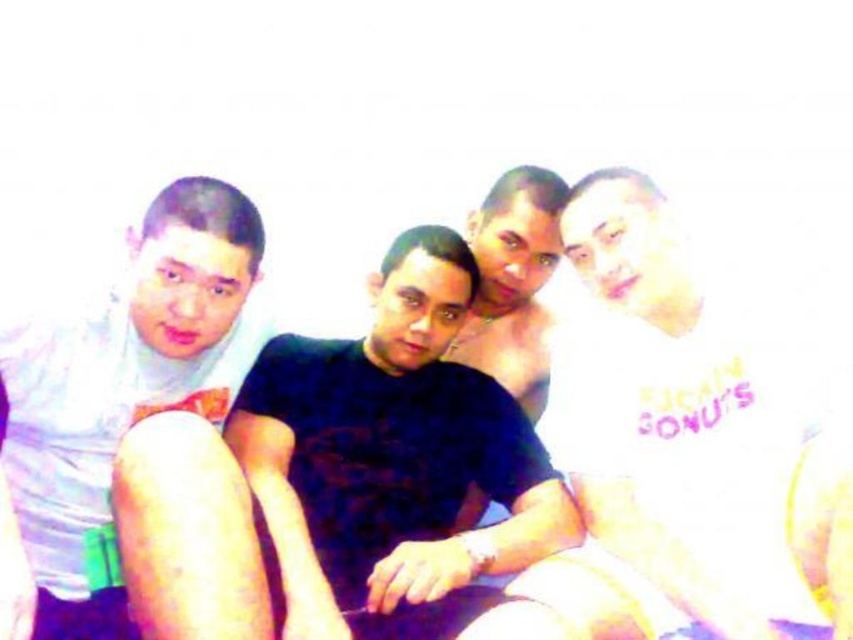
Between point (439, 314) and point (77, 630), which one is positioned in front?

Point (77, 630) is more forward.

Does point (450, 410) come closer to viewer compared to point (57, 442)?

No, (450, 410) is further to viewer.

Identify the location of black matte shirt at center. (392, 452).